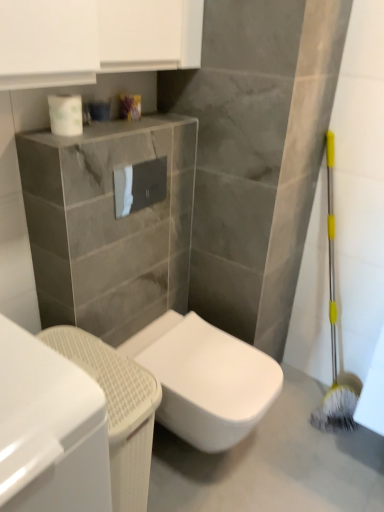
Where is `free region under white glossy toilet at center (from a real-world perspective)`? free region under white glossy toilet at center (from a real-world perspective) is located at coordinates (214, 461).